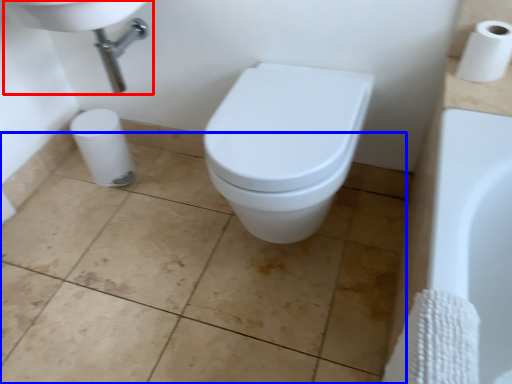
Question: Which object is closer to the camera taking this photo, sink (highlighted by a red box) or ceramic tile (highlighted by a blue box)?

Choices:
 (A) sink
 (B) ceramic tile

Answer: (B)